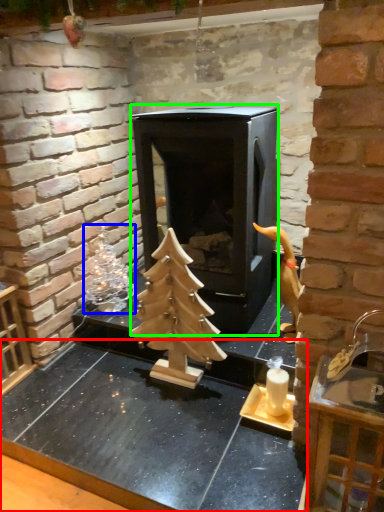
Question: Which object is positioned closest to counter top (highlighted by a red box)? Select from christmas decoration (highlighted by a blue box) and fireplace (highlighted by a green box).

Choices:
 (A) christmas decoration
 (B) fireplace

Answer: (A)